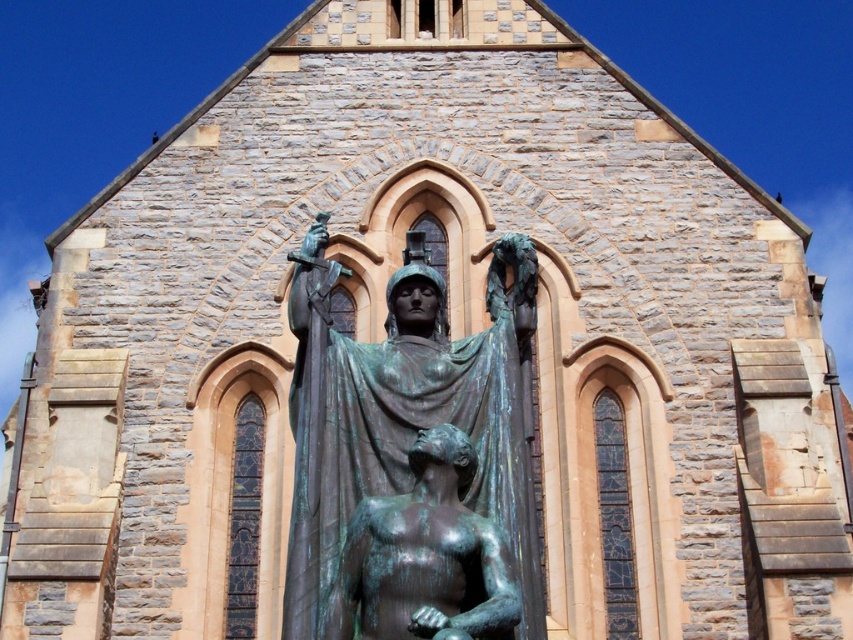
You are standing in front of the church and see the bronze statue at center and the green patina statue at center. Which one is positioned to the left?

The bronze statue at center is positioned to the left of the green patina statue at center.

You are standing at a viewpoint where the bronze statue at center is visible. If you want to take a photo of the statue with a camera that has a focal length of 50mm, what is the minimum distance you need to be from the statue to ensure it fits entirely within the frame?

The bronze statue at center is 28.24 meters away from the camera. To ensure the statue fits within the frame using a 50mm focal length, you should position yourself at least 28.24 meters away from the statue.